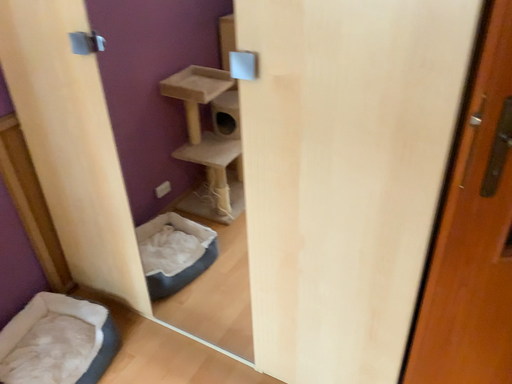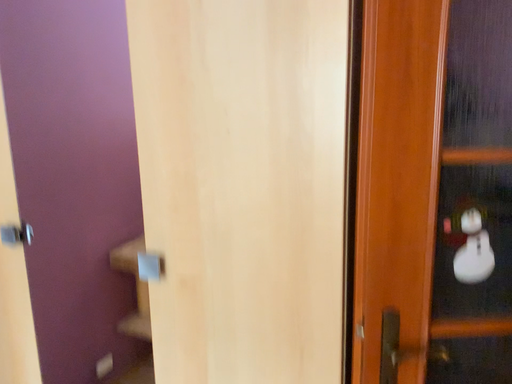
Question: How did the camera likely rotate when shooting the video?

Choices:
 (A) rotated upward
 (B) rotated downward

Answer: (A)